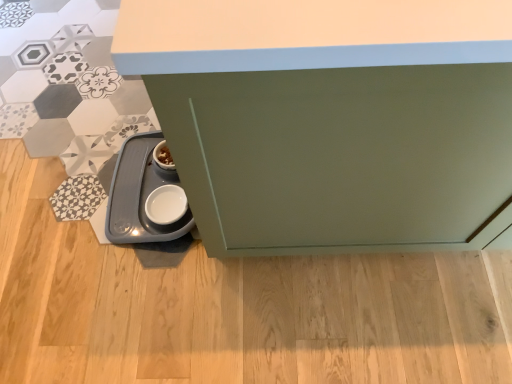
I want to click on vacant position to the left of white glossy pet feeder at lower left, so click(56, 200).